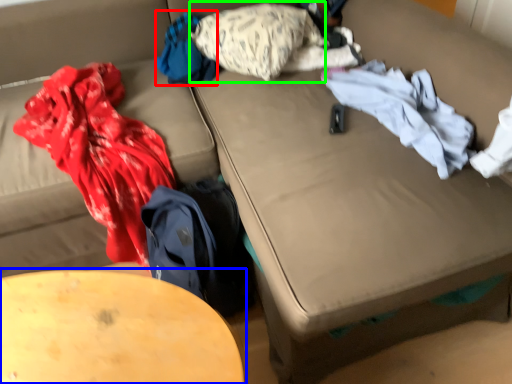
Question: Which object is the farthest from clothing (highlighted by a red box)? Choose among these: table (highlighted by a blue box) or pillow (highlighted by a green box).

Choices:
 (A) table
 (B) pillow

Answer: (A)